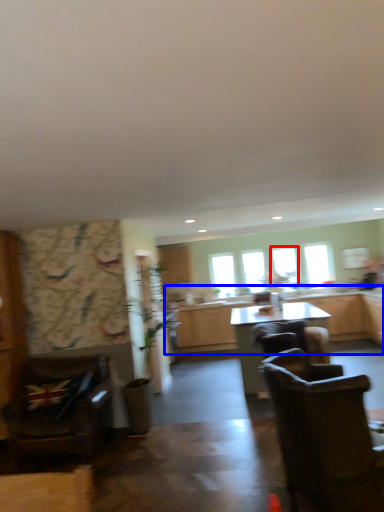
Question: Which of the following is the farthest to the observer, window (highlighted by a red box) or cabinetry (highlighted by a blue box)?

Choices:
 (A) window
 (B) cabinetry

Answer: (A)